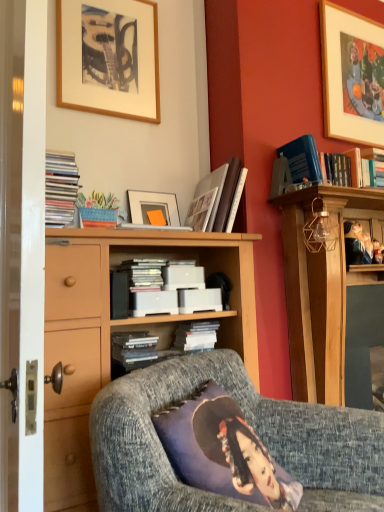
What do you see at coordinates (302, 159) in the screenshot? The width and height of the screenshot is (384, 512). I see `hardcover book at upper right, the first book positioned from the right` at bounding box center [302, 159].

Identify the location of wooden picture frame at upper left, the 1th picture frame viewed from the left. (108, 58).

What is the approximate width of smooth wooden frame at upper right, which is counted as the 1th person, starting from the right?

smooth wooden frame at upper right, which is counted as the 1th person, starting from the right, is 1.39 inches in width.

What do you see at coordinates (134, 349) in the screenshot?
I see `white matte book at center, the third book viewed from the right` at bounding box center [134, 349].

At what (x,y) coordinates should I click in order to perform the action: click on textured gray armchair at center. Please return your answer as a coordinate pair (x, y). The height and width of the screenshot is (512, 384). Looking at the image, I should click on (249, 423).

Is smooth wooden frame at upper right, which is counted as the 1th person, starting from the right, wider than white matte book at center, which is counted as the 1th book, starting from the bottom?

Incorrect, the width of smooth wooden frame at upper right, which is counted as the 1th person, starting from the right, does not surpass that of white matte book at center, which is counted as the 1th book, starting from the bottom.

From the image's perspective, which one is positioned lower, smooth wooden frame at upper right, the 2th person when ordered from left to right, or white matte book at center, which is the 4th book in top-to-bottom order?

white matte book at center, which is the 4th book in top-to-bottom order.

Which of these two, smooth wooden frame at upper right, which is counted as the 1th person, starting from the right, or white matte book at center, which is counted as the 1th book, starting from the bottom, stands taller?

Standing taller between the two is white matte book at center, which is counted as the 1th book, starting from the bottom.

Could you tell me if smooth wooden frame at upper right, the 2th person when ordered from left to right, is turned towards white matte book at center, which is counted as the 1th book, starting from the bottom?

No, smooth wooden frame at upper right, the 2th person when ordered from left to right, is not facing towards white matte book at center, which is counted as the 1th book, starting from the bottom.

Can you confirm if white matte book at center, which appears as the third book when viewed from the left, is taller than white matte book at center, which is counted as the 1th book, starting from the bottom?

Yes, white matte book at center, which appears as the third book when viewed from the left, is taller than white matte book at center, which is counted as the 1th book, starting from the bottom.

Which object is positioned more to the left, white matte book at center, the second book ordered from the bottom, or white matte book at center, the third book viewed from the right?

white matte book at center, the third book viewed from the right, is more to the left.

Looking at this image, looking at their sizes, would you say white matte book at center, which is counted as the 3th book, starting from the top, is wider or thinner than white matte book at center, which is the 4th book in top-to-bottom order?

Clearly, white matte book at center, which is counted as the 3th book, starting from the top, has more width compared to white matte book at center, which is the 4th book in top-to-bottom order.

From the picture: Can you tell me how much white matte book at center, the second book from the right, and white matte book at center, which is counted as the 1th book, starting from the bottom, differ in facing direction?

The angular difference between white matte book at center, the second book from the right, and white matte book at center, which is counted as the 1th book, starting from the bottom, is 0.00117 degrees.

Which of these two, wooden picture frame at upper right, which is the 2th picture frame from left to right, or smooth wooden frame at upper right, the 2th person when ordered from left to right, is thinner?

smooth wooden frame at upper right, the 2th person when ordered from left to right.

In the scene shown: Can you confirm if wooden picture frame at upper right, arranged as the first picture frame when viewed from the right, is positioned to the right of smooth wooden frame at upper right, which is counted as the 1th person, starting from the right?

Yes.

Is wooden picture frame at upper right, which is the 2th picture frame from left to right, positioned behind smooth wooden frame at upper right, the 2th person when ordered from left to right?

Yes, the depth of wooden picture frame at upper right, which is the 2th picture frame from left to right, is greater than that of smooth wooden frame at upper right, the 2th person when ordered from left to right.

What's the angular difference between wooden picture frame at upper right, which is the 2th picture frame from left to right, and smooth wooden frame at upper right, which is counted as the 1th person, starting from the right,'s facing directions?

The facing directions of wooden picture frame at upper right, which is the 2th picture frame from left to right, and smooth wooden frame at upper right, which is counted as the 1th person, starting from the right, are 0.676 degrees apart.

Is white glossy door at left directly adjacent to hardcover book at upper right, the fourth book when ordered from bottom to top?

No, white glossy door at left is not next to hardcover book at upper right, the fourth book when ordered from bottom to top.

Can you confirm if white glossy door at left is bigger than hardcover book at upper right, the first book positioned from the right?

Indeed, white glossy door at left has a larger size compared to hardcover book at upper right, the first book positioned from the right.

Consider the image. Which is closer, (41,508) or (340,157)?

Positioned in front is point (41,508).

From the image's perspective, which one is positioned higher, white glossy door at left or smooth wooden frame at upper right, the 2th person when ordered from left to right?

white glossy door at left.

What's the angular difference between white glossy door at left and smooth wooden frame at upper right, which is counted as the 1th person, starting from the right,'s facing directions?

The angular difference between white glossy door at left and smooth wooden frame at upper right, which is counted as the 1th person, starting from the right, is 83.1 degrees.

Is white glossy door at left shorter than smooth wooden frame at upper right, the 2th person when ordered from left to right?

No.

From a real-world perspective, is white glossy door at left on smooth wooden frame at upper right, the 2th person when ordered from left to right?

Yes, from a real-world perspective, white glossy door at left is above smooth wooden frame at upper right, the 2th person when ordered from left to right.

Is the depth of smooth wooden frame at upper right, which is counted as the 1th person, starting from the right, greater than that of white matte book at center, which is counted as the 3th book, starting from the top?

Yes, the depth of smooth wooden frame at upper right, which is counted as the 1th person, starting from the right, is greater than that of white matte book at center, which is counted as the 3th book, starting from the top.

Measure the distance between smooth wooden frame at upper right, the 2th person when ordered from left to right, and white matte book at center, which is counted as the 3th book, starting from the top.

The distance of smooth wooden frame at upper right, the 2th person when ordered from left to right, from white matte book at center, which is counted as the 3th book, starting from the top, is 32.55 inches.

Consider the image. Is smooth wooden frame at upper right, which is counted as the 1th person, starting from the right, facing towards white matte book at center, the second book ordered from the bottom?

No, smooth wooden frame at upper right, which is counted as the 1th person, starting from the right, does not turn towards white matte book at center, the second book ordered from the bottom.

Considering the positions of objects smooth wooden frame at upper right, which is counted as the 1th person, starting from the right, and white matte book at center, the second book ordered from the bottom, in the image provided, who is more to the right, smooth wooden frame at upper right, which is counted as the 1th person, starting from the right, or white matte book at center, the second book ordered from the bottom,?

From the viewer's perspective, smooth wooden frame at upper right, which is counted as the 1th person, starting from the right, appears more on the right side.

Does white matte book at center, which is counted as the 2th book, starting from the left, have a lesser width compared to textured gray armchair at center?

Yes, white matte book at center, which is counted as the 2th book, starting from the left, is thinner than textured gray armchair at center.

Consider the image. Is white matte book at center, which is the 4th book in top-to-bottom order, positioned with its back to textured gray armchair at center?

No, textured gray armchair at center is not at the back of white matte book at center, which is the 4th book in top-to-bottom order.

Based on their sizes in the image, would you say white matte book at center, the third book viewed from the right, is bigger or smaller than textured gray armchair at center?

In the image, white matte book at center, the third book viewed from the right, appears to be smaller than textured gray armchair at center.

Is white matte book at center, which is the 4th book in top-to-bottom order, not inside textured gray armchair at center?

That's correct, white matte book at center, which is the 4th book in top-to-bottom order, is outside of textured gray armchair at center.

From the image's perspective, count 1st persons upward from the white matte book at center, the third book viewed from the right, and point to it. Please provide its 2D coordinates.

[(378, 252)]

This screenshot has width=384, height=512. Find the location of `the 1st book counting from the right of the white matte book at center, which is the 4th book in top-to-bottom order`. the 1st book counting from the right of the white matte book at center, which is the 4th book in top-to-bottom order is located at coordinates click(x=196, y=335).

Which object lies further to the anchor point wooden cabinet at center, textured gray armchair at center or white glossy door at left?

white glossy door at left lies further to wooden cabinet at center than the other object.

From the image, which object appears to be farther from white glossy door at left, wooden picture frame at upper left, the first picture frame in the front-to-back sequence, or wooden picture frame at upper right, the 2th picture frame positioned from the front?

wooden picture frame at upper right, the 2th picture frame positioned from the front, is positioned further to the anchor white glossy door at left.

Estimate the real-world distances between objects in this image. Which object is closer to white glossy door at left, white matte book at center, which appears as the third book when viewed from the left, or smooth wooden frame at upper right, the 2th person when ordered from left to right?

white matte book at center, which appears as the third book when viewed from the left, is positioned closer to the anchor white glossy door at left.

Based on their spatial positions, is white matte book at center, the second book ordered from the bottom, or wooden cabinet at center further from smooth wooden frame at upper right, which is counted as the second person, starting from the right?

wooden cabinet at center.

From the image, which object appears to be farther from white matte book at center, the second book from the right, matte black books at left, which ranks as the fourth book in right-to-left order, or wooden cabinet at center?

matte black books at left, which ranks as the fourth book in right-to-left order, is positioned further to the anchor white matte book at center, the second book from the right.

Looking at the image, which one is located further to smooth wooden frame at upper right, positioned as the first person in left-to-right order, wooden cabinet at center or matte black books at left, the second book viewed from the top?

matte black books at left, the second book viewed from the top, is further to smooth wooden frame at upper right, positioned as the first person in left-to-right order.

Looking at the image, which one is located further to matte black books at left, the first book positioned from the left, smooth wooden frame at upper right, which is counted as the 1th person, starting from the right, or wooden picture frame at upper right, which is the 2th picture frame from left to right?

wooden picture frame at upper right, which is the 2th picture frame from left to right, is positioned further to the anchor matte black books at left, the first book positioned from the left.

When comparing their distances from white glossy door at left, does wooden picture frame at upper right, the 2th picture frame positioned from the front, or hardcover book at upper right, the first book positioned from the right, seem further?

Among the two, wooden picture frame at upper right, the 2th picture frame positioned from the front, is located further to white glossy door at left.

At what (x,y) coordinates should I click in order to perform the action: click on cabinetry between white glossy door at left and textured gray armchair at center in the horizontal direction. Please return your answer as a coordinate pair (x, y). This screenshot has width=384, height=512. Looking at the image, I should click on (121, 330).

At what (x,y) coordinates should I click in order to perform the action: click on picture frame between white glossy door at left and wooden picture frame at upper right, the 2th picture frame positioned from the front, from left to right. Please return your answer as a coordinate pair (x, y). The height and width of the screenshot is (512, 384). Looking at the image, I should click on (108, 58).

Where is `cabinetry positioned between textured gray armchair at center and white matte book at center, the third book viewed from the right, from near to far`? The width and height of the screenshot is (384, 512). cabinetry positioned between textured gray armchair at center and white matte book at center, the third book viewed from the right, from near to far is located at coordinates 121,330.

Find the location of a particular element. The width and height of the screenshot is (384, 512). cabinetry between white matte book at center, the third book viewed from the right, and smooth wooden frame at upper right, positioned as the first person in left-to-right order, in the horizontal direction is located at coordinates (121, 330).